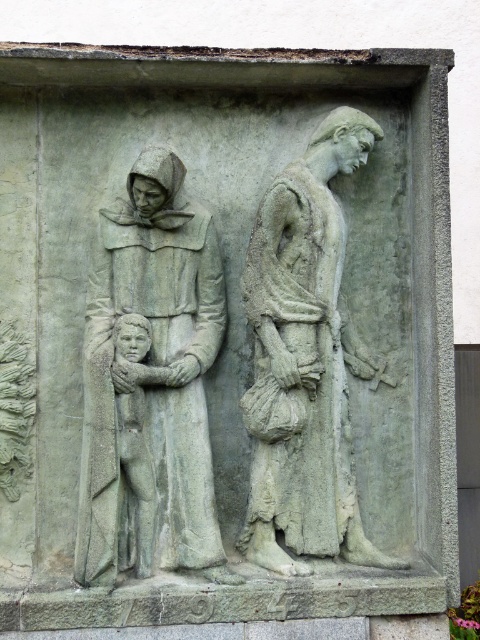
From the picture: Is gray stone figure at left below gray stone child at center?

Actually, gray stone figure at left is above gray stone child at center.

Consider the image. Is gray stone figure at left further to the viewer compared to gray stone child at center?

No, it is in front of gray stone child at center.

Who is more forward, (109, 483) or (162, 368)?

Positioned in front is point (109, 483).

I want to click on gray stone figure at left, so [x=151, y=384].

Is gray stone figure at center bigger than gray stone child at center?

Indeed, gray stone figure at center has a larger size compared to gray stone child at center.

Locate an element on the screen. This screenshot has height=640, width=480. gray stone figure at center is located at coordinates (304, 362).

Is point (187, 342) positioned behind point (301, 324)?

Yes, it is behind point (301, 324).

Does gray stone figure at left appear on the right side of gray stone figure at center?

No, gray stone figure at left is not to the right of gray stone figure at center.

In the scene shown: Who is more distant from viewer, (x=139, y=481) or (x=296, y=225)?

The point (x=296, y=225) is more distant.

Where is `gray stone figure at left`? The height and width of the screenshot is (640, 480). gray stone figure at left is located at coordinates (151, 384).